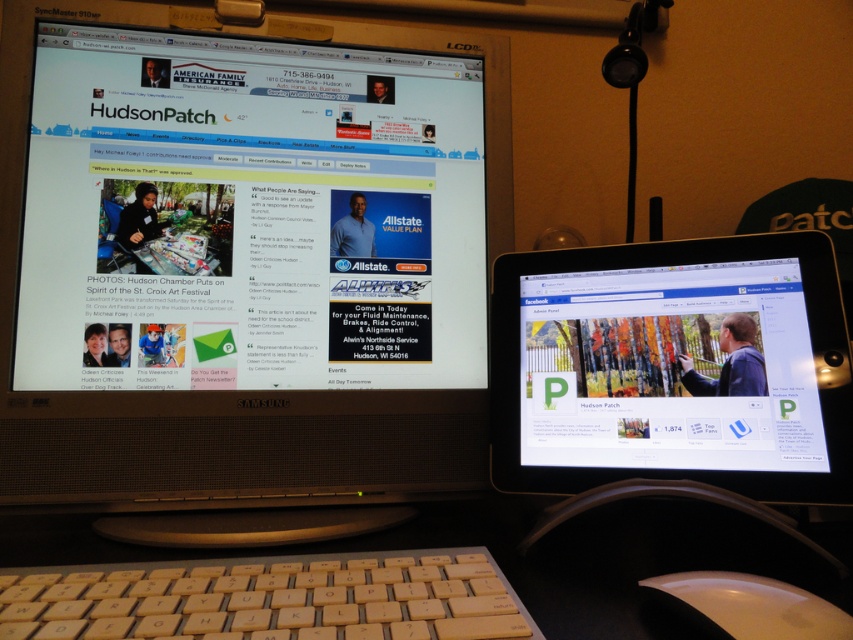
Image resolution: width=853 pixels, height=640 pixels. Identify the location of matte white tablet at right. (669, 369).

The image size is (853, 640). What do you see at coordinates (669, 369) in the screenshot? I see `matte white tablet at right` at bounding box center [669, 369].

At what (x,y) coordinates should I click in order to perform the action: click on matte white tablet at right. Please return your answer as a coordinate pair (x, y). Image resolution: width=853 pixels, height=640 pixels. Looking at the image, I should click on (669, 369).

Image resolution: width=853 pixels, height=640 pixels. Describe the element at coordinates (245, 269) in the screenshot. I see `matte black monitor at left` at that location.

Which is in front, point (178, 54) or point (534, 300)?

Point (534, 300) is more forward.

The width and height of the screenshot is (853, 640). I want to click on matte black monitor at left, so click(x=245, y=269).

Find the location of a particular element. matte black monitor at left is located at coordinates (245, 269).

Who is positioned more to the left, matte black monitor at left or yellow plastic keyboard at lower center?

Positioned to the left is matte black monitor at left.

Find the location of a particular element. The width and height of the screenshot is (853, 640). matte black monitor at left is located at coordinates (245, 269).

Who is more forward, (x=100, y=317) or (x=283, y=600)?

Point (x=283, y=600)

You are a GUI agent. You are given a task and a screenshot of the screen. Output one action in this format:
    pyautogui.click(x=<x>, y=<y>)
    Task: Click on the matte black monitor at left
    The height and width of the screenshot is (640, 853).
    Given the screenshot: What is the action you would take?
    [245, 269]